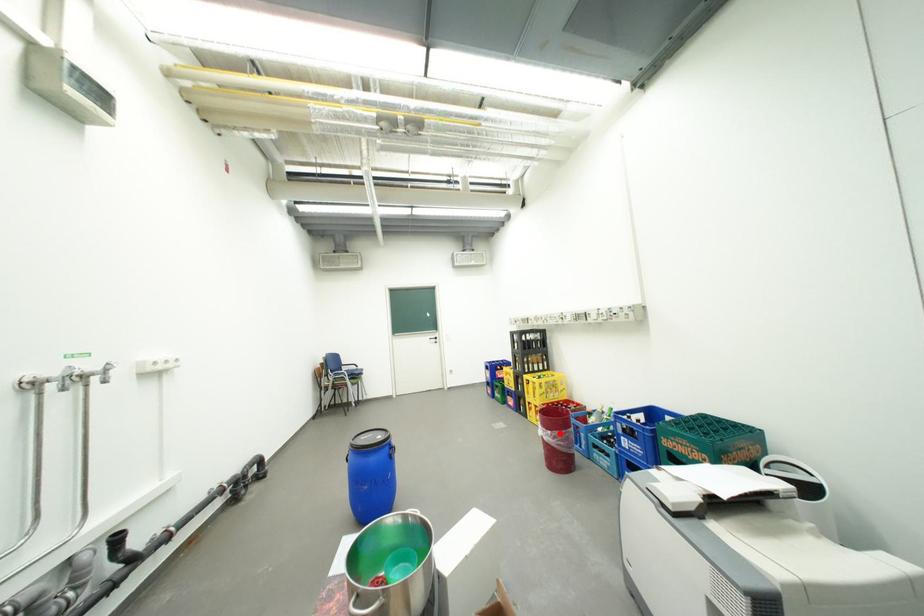
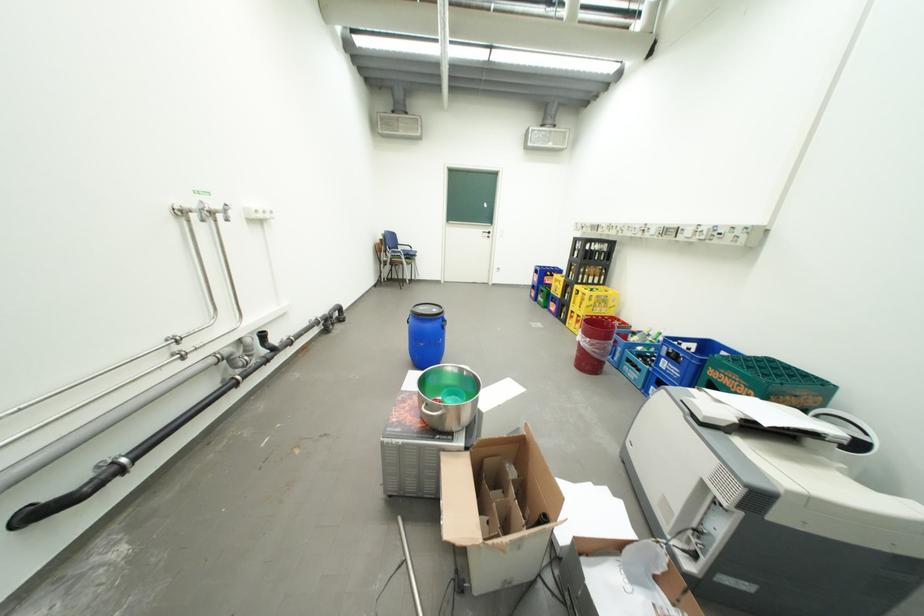
Question: I am providing you with two images of the same scene from different viewpoints. Given a red point in image1, look at the same physical point in image2. Is it:

Choices:
 (A) Closer to the viewpoint
 (B) Farther from the viewpoint

Answer: (A)